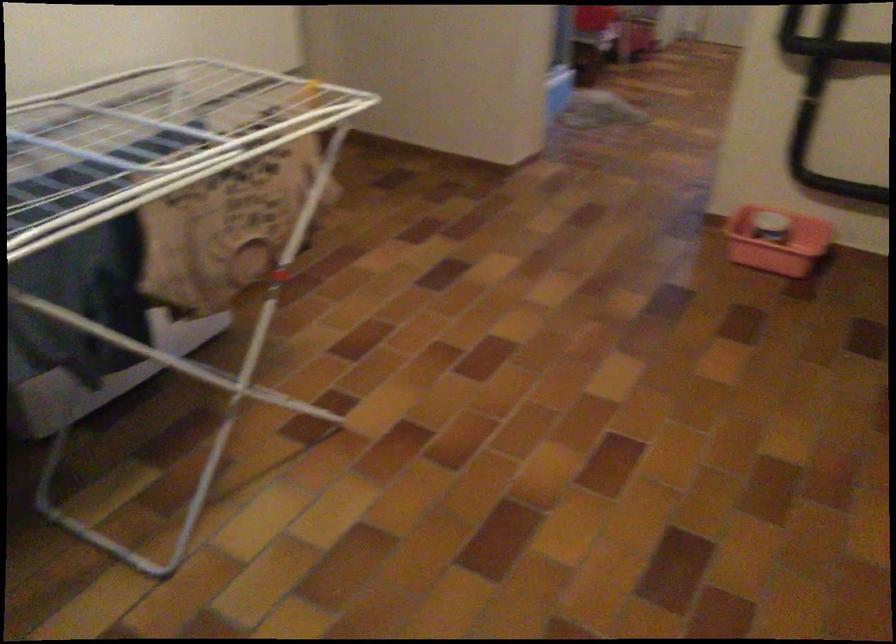
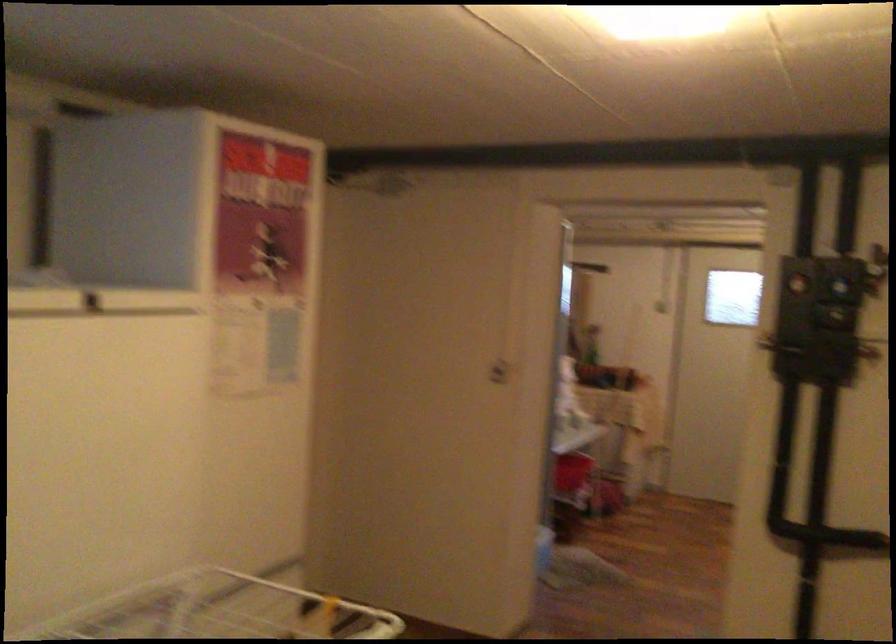
Question: The images are taken continuously from a first-person perspective. In which direction are you moving?

Choices:
 (A) Left
 (B) Right
 (C) Forward
 (D) Backward

Answer: (A)